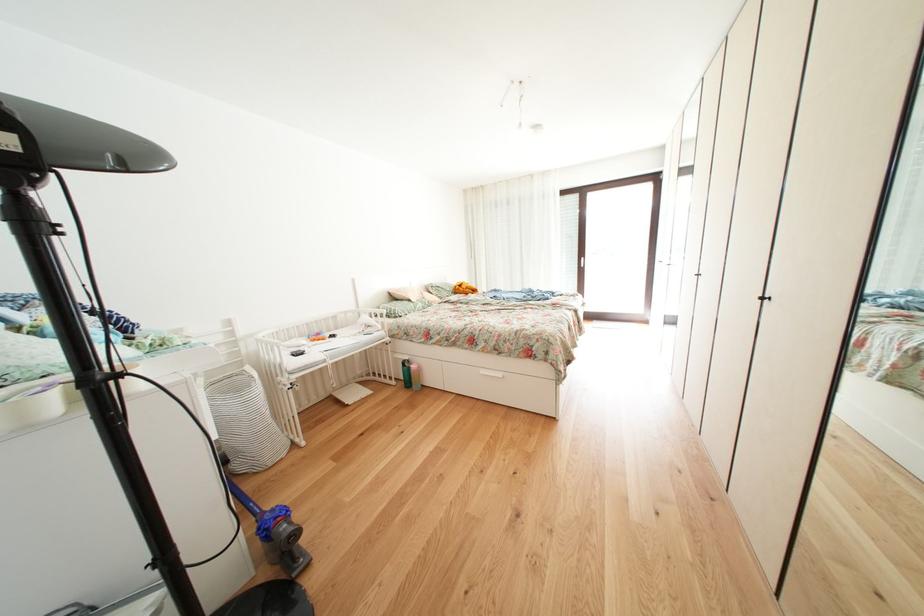
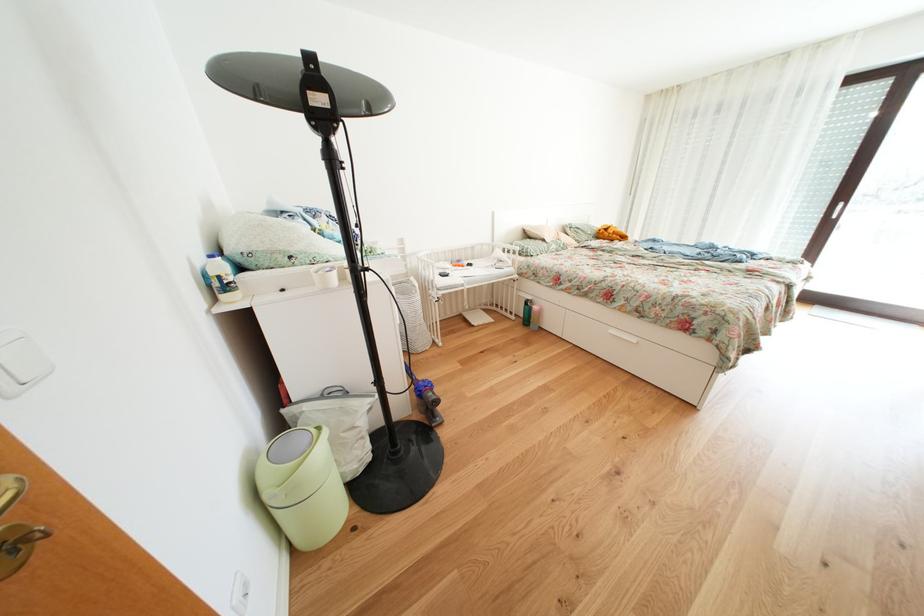
In the second image, find the point that corresponds to [492,377] in the first image.

(622, 336)